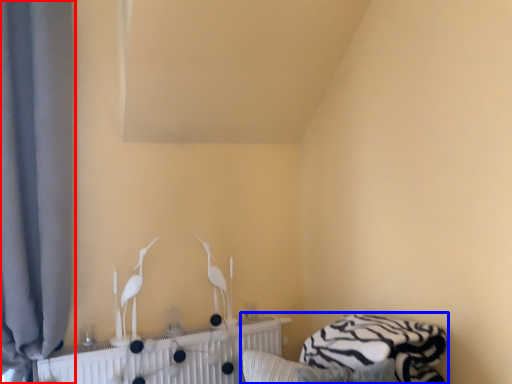
Question: Which of the following is the farthest to the observer, curtain (highlighted by a red box) or bed (highlighted by a blue box)?

Choices:
 (A) curtain
 (B) bed

Answer: (A)